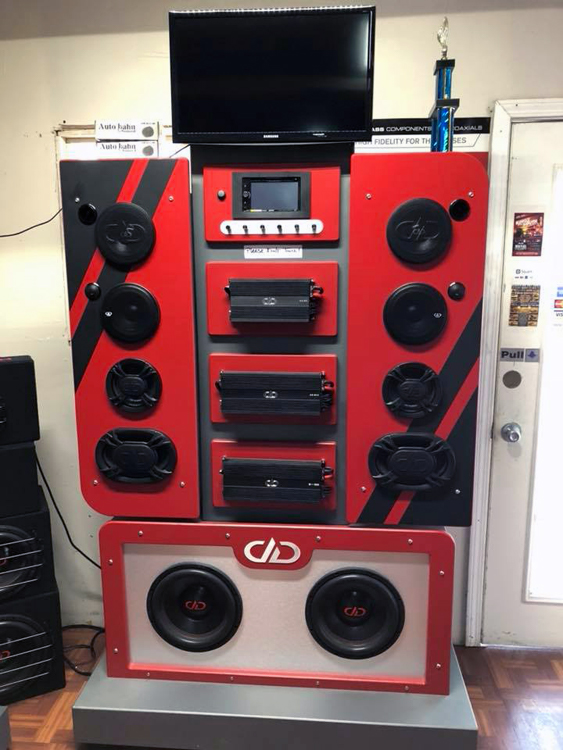
Locate an element on the screen. The image size is (563, 750). door is located at coordinates coord(520,499).